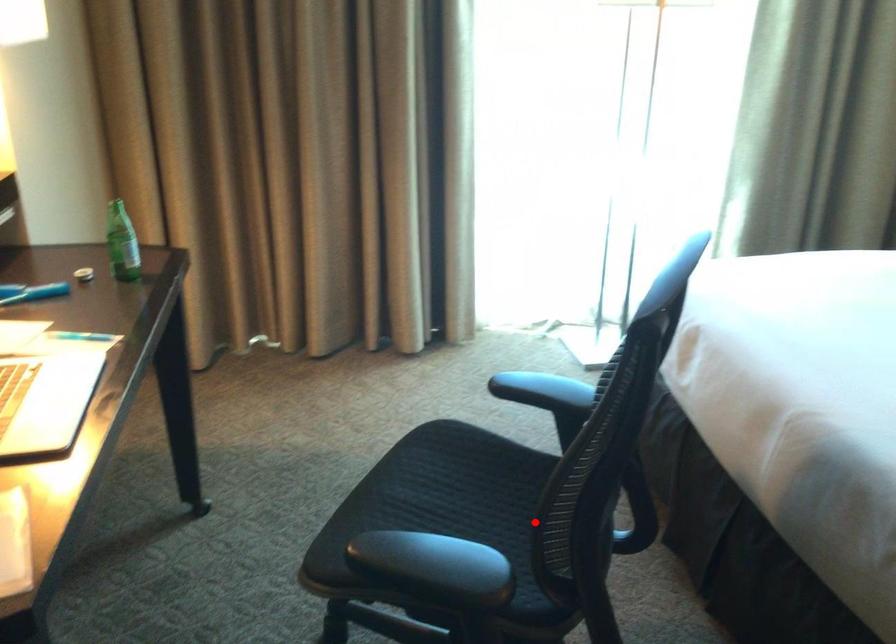
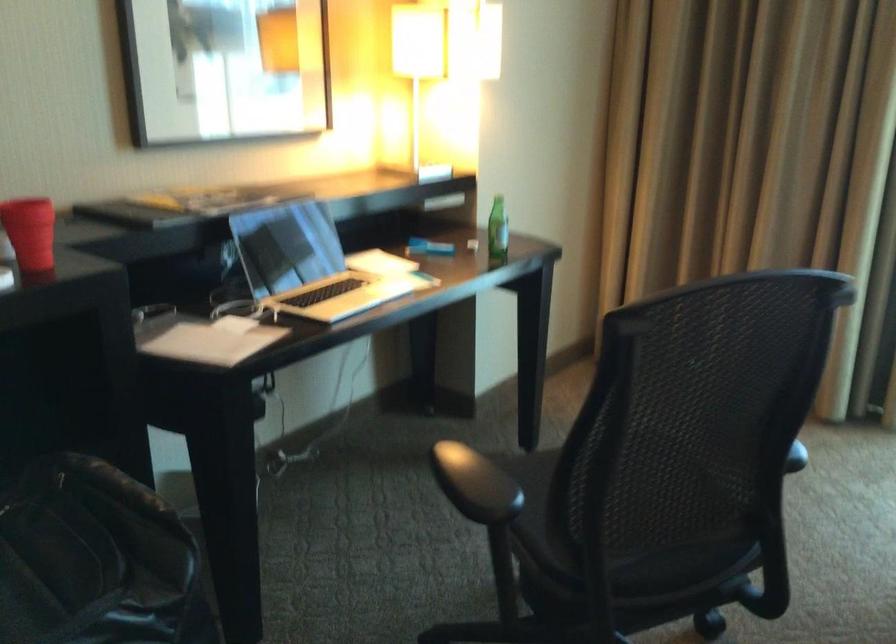
Question: A red point is marked in image1. In image2, is the corresponding 3D point closer to the camera or farther? Reply with the corresponding letter.

Choices:
 (A) The corresponding 3D point is closer.
 (B) The corresponding 3D point is farther.

Answer: (B)